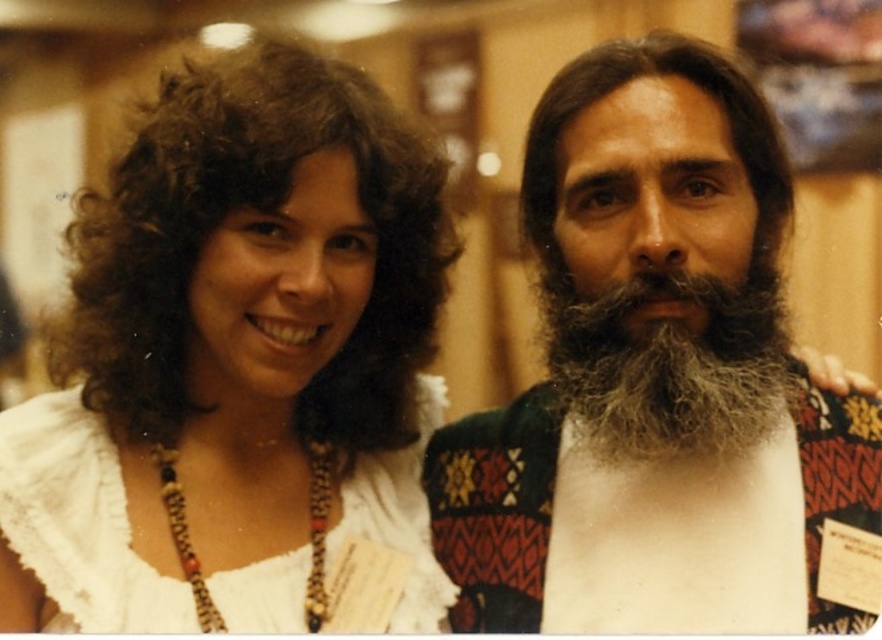
Question: Is dark curly hair at left wider than beaded necklace at center?

Choices:
 (A) yes
 (B) no

Answer: (A)

Question: Does dark curly hair at left appear under grayish-brown textured beard at center?

Choices:
 (A) yes
 (B) no

Answer: (B)

Question: Does dark curly hair at left have a greater width compared to white lace dress at center?

Choices:
 (A) yes
 (B) no

Answer: (B)

Question: Which of the following is the closest to the observer?

Choices:
 (A) dark curly hair at left
 (B) beaded necklace at center
 (C) white lace dress at center

Answer: (C)

Question: Which point appears closest to the camera in this image?

Choices:
 (A) (670, 372)
 (B) (16, 525)

Answer: (B)

Question: Which of the following is the closest to the observer?

Choices:
 (A) (311, 440)
 (B) (270, 124)

Answer: (B)